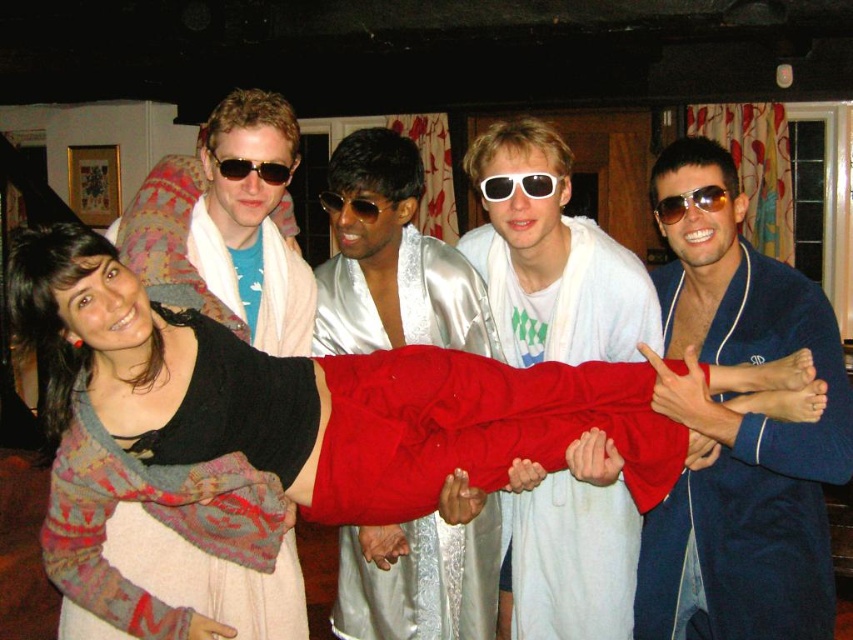
Question: Does white satin robe at center come in front of gold reflective sunglasses at center?

Choices:
 (A) no
 (B) yes

Answer: (A)

Question: Does white satin robe at center appear on the right side of white plastic sunglasses at center?

Choices:
 (A) yes
 (B) no

Answer: (A)

Question: Which point is closer to the camera taking this photo?

Choices:
 (A) (265, 173)
 (B) (367, 196)

Answer: (A)

Question: Which point is farther from the camera taking this photo?

Choices:
 (A) (666, 568)
 (B) (341, 212)
 (C) (250, 173)
 (D) (416, 336)

Answer: (D)

Question: Is knitted sweater at center smaller than matte white towel at upper left?

Choices:
 (A) no
 (B) yes

Answer: (A)

Question: Considering the real-world distances, which object is farthest from the white satin robe at center?

Choices:
 (A) knitted wool dress at lower left
 (B) black plastic sunglasses at upper center

Answer: (A)